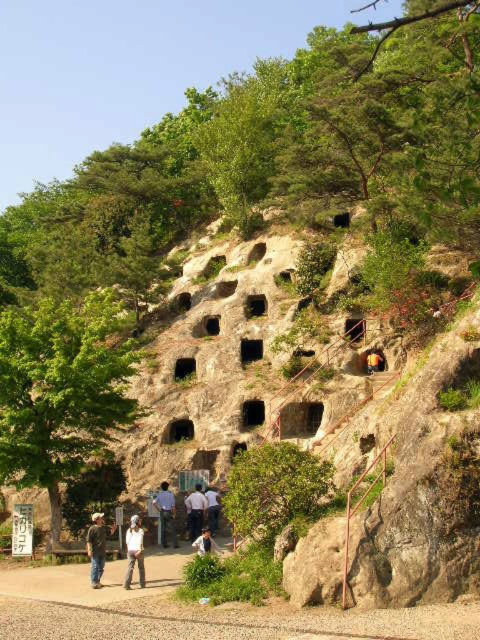
Question: Does khaki cotton pants at lower center have a smaller size compared to white shirt at center?

Choices:
 (A) no
 (B) yes

Answer: (A)

Question: Which of these objects is positioned farthest from the white cotton shirt at center?

Choices:
 (A) yellow fabric at center
 (B) light brown leather jacket at center
 (C) white cotton shirt at lower center
 (D) green leafy bush at lower center

Answer: (A)

Question: Observing the image, what is the correct spatial positioning of white cotton shirt at lower center in reference to light brown leather jacket at center?

Choices:
 (A) right
 (B) left

Answer: (B)

Question: Which point is closer to the camera taking this photo?

Choices:
 (A) (375, 362)
 (B) (288, 488)
 (C) (170, 509)
 (D) (205, 502)

Answer: (B)

Question: Does white cotton shirt at lower center have a larger size compared to white cotton shirt at center?

Choices:
 (A) no
 (B) yes

Answer: (B)

Question: Which point appears closest to the camera in this image?

Choices:
 (A) (214, 531)
 (B) (205, 531)
 (C) (93, 544)

Answer: (C)